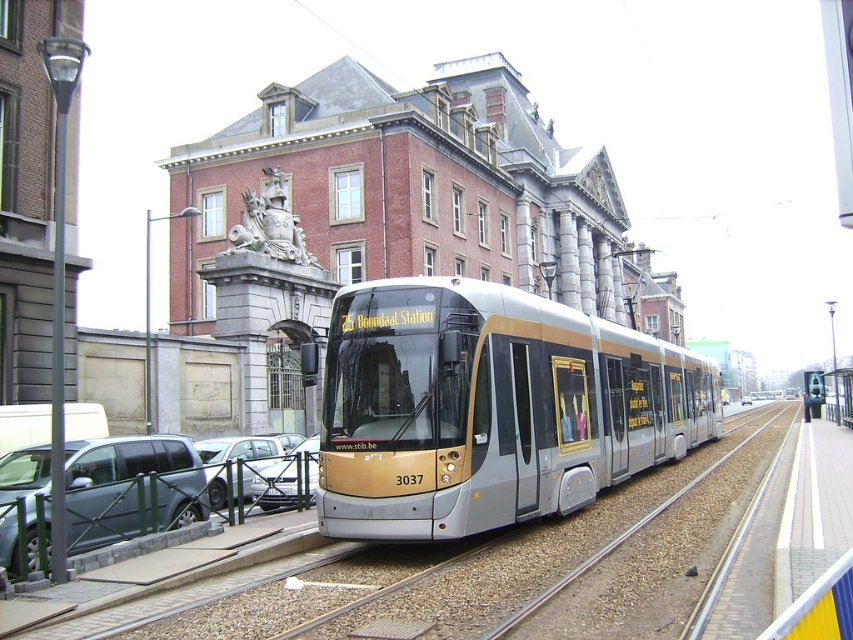
Is gold metallic tram at center smaller than silver metallic car at lower left?

Incorrect, gold metallic tram at center is not smaller in size than silver metallic car at lower left.

Is gold metallic tram at center to the right of silver metallic car at lower left from the viewer's perspective?

Indeed, gold metallic tram at center is positioned on the right side of silver metallic car at lower left.

Locate an element on the screen. The image size is (853, 640). gold metallic tram at center is located at coordinates (490, 406).

Who is taller, metallic gray suv at lower left or metallic silver car at center?

metallic gray suv at lower left is taller.

Find the location of a particular element. This screenshot has width=853, height=640. metallic gray suv at lower left is located at coordinates (131, 486).

Is point (160, 477) behind point (289, 481)?

No, it is not.

You are a GUI agent. You are given a task and a screenshot of the screen. Output one action in this format:
    pyautogui.click(x=<x>, y=<y>)
    Task: Click on the metallic gray suv at lower left
    This screenshot has width=853, height=640.
    Given the screenshot: What is the action you would take?
    pyautogui.click(x=131, y=486)

Can you confirm if silver metallic car at lower left is smaller than metallic silver car at center?

No.

Can you confirm if silver metallic car at lower left is wider than metallic silver car at center?

Indeed, silver metallic car at lower left has a greater width compared to metallic silver car at center.

Locate an element on the screen. The height and width of the screenshot is (640, 853). silver metallic car at lower left is located at coordinates (233, 461).

Identify the location of silver metallic car at lower left. point(233,461).